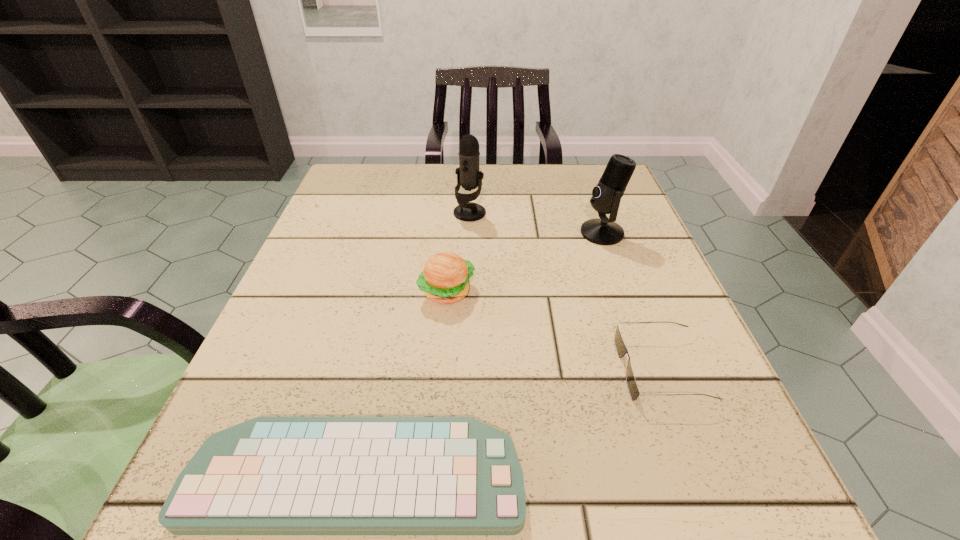
The image size is (960, 540). Identify the location of the left microphone. (468, 176).

Locate an element on the screen. This screenshot has height=540, width=960. the right microphone is located at coordinates (606, 196).

Identify the location of hamburger. The image size is (960, 540). (445, 278).

Identify the location of the third shortest object. The width and height of the screenshot is (960, 540). (445, 278).

Identify the location of the fourth tallest object. (621, 349).

Find the location of a particular element. This screenshot has width=960, height=540. the fourth farthest object is located at coordinates (621, 349).

Image resolution: width=960 pixels, height=540 pixels. In order to click on the shortest object in this screenshot , I will do `click(269, 475)`.

Locate an element on the screen. the nearest object is located at coordinates (269, 475).

The image size is (960, 540). What are the coordinates of `vacant space located on the front of the left microphone` in the screenshot? It's located at (466, 345).

Find the location of `free space located on the stand of the right microphone`. free space located on the stand of the right microphone is located at coordinates (480, 233).